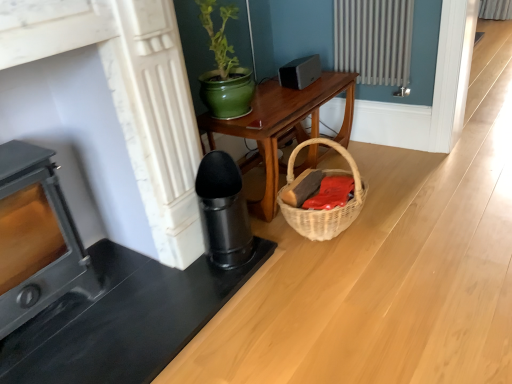
Describe the element at coordinates (331, 193) in the screenshot. This screenshot has height=384, width=512. I see `woven basket at lower right` at that location.

The image size is (512, 384). Describe the element at coordinates (34, 235) in the screenshot. I see `metallic gray heater at left` at that location.

The height and width of the screenshot is (384, 512). Describe the element at coordinates (300, 72) in the screenshot. I see `satin black speaker at upper center` at that location.

Identify the location of woven natural basket at center. Image resolution: width=512 pixels, height=384 pixels. (324, 210).

Identify the location of wooden table at center. (283, 126).

How far apart are wooden table at center and satin black speaker at upper center?

wooden table at center and satin black speaker at upper center are 12.38 inches apart.

Which is correct: wooden table at center is inside satin black speaker at upper center, or outside of it?

wooden table at center is not inside satin black speaker at upper center, it's outside.

Is wooden table at center aimed at satin black speaker at upper center?

No, wooden table at center does not turn towards satin black speaker at upper center.

Between wooden table at center and satin black speaker at upper center, which one has larger size?

wooden table at center is bigger.

Does metallic gray heater at left appear on the left side of woven natural basket at center?

Correct, you'll find metallic gray heater at left to the left of woven natural basket at center.

Choose the correct answer: Is metallic gray heater at left inside woven natural basket at center or outside it?

metallic gray heater at left is outside woven natural basket at center.

Which object is closer to the camera taking this photo, metallic gray heater at left or woven natural basket at center?

metallic gray heater at left is closer to the camera.

Based on the photo, would you say woven natural basket at center is a long distance from satin black speaker at upper center?

That's not correct — woven natural basket at center is a little close to satin black speaker at upper center.

Who is bigger, woven natural basket at center or satin black speaker at upper center?

woven natural basket at center.

Would you say woven natural basket at center is inside or outside satin black speaker at upper center?

woven natural basket at center exists outside the volume of satin black speaker at upper center.

Is point (278, 199) closer or farther from the camera than point (287, 77)?

Point (278, 199).

From the image's perspective, relative to metallic gray heater at left, is woven natural basket at center above or below?

A: woven natural basket at center is situated higher than metallic gray heater at left in the image.

Considering the sizes of woven natural basket at center and metallic gray heater at left in the image, is woven natural basket at center taller or shorter than metallic gray heater at left?

Considering their sizes, woven natural basket at center has less height than metallic gray heater at left.

From a real-world perspective, which is physically below, woven natural basket at center or metallic gray heater at left?

In real-world perspective, woven natural basket at center is lower.

Is woven natural basket at center oriented towards metallic gray heater at left?

No, woven natural basket at center is not turned towards metallic gray heater at left.

Consider the image. Between wooden table at center and woven natural basket at center, which one is positioned in front?

woven natural basket at center is in front.

Looking at this image, is wooden table at center situated inside woven natural basket at center or outside?

wooden table at center lies outside woven natural basket at center.

From the image's perspective, does wooden table at center appear lower than woven natural basket at center?

Incorrect, from the image's perspective, wooden table at center is higher than woven natural basket at center.

Who is shorter, wooden table at center or woven natural basket at center?

A: Standing shorter between the two is woven natural basket at center.

Does woven natural basket at center have a larger size compared to woven basket at lower right?

Indeed, woven natural basket at center has a larger size compared to woven basket at lower right.

Does point (348, 161) lie in front of point (325, 193)?

Yes, point (348, 161) is in front of point (325, 193).

Is woven natural basket at center facing away from woven basket at lower right?

Yes, woven basket at lower right is at the back of woven natural basket at center.

In the image, is woven natural basket at center on the left side or the right side of woven basket at lower right?

Based on their positions, woven natural basket at center is located to the left of woven basket at lower right.

From the image's perspective, would you say woven basket at lower right is shown under wooden table at center?

Yes, from the image's perspective, woven basket at lower right is beneath wooden table at center.

Looking at this image, considering the relative sizes of woven basket at lower right and wooden table at center in the image provided, is woven basket at lower right taller than wooden table at center?

In fact, woven basket at lower right may be shorter than wooden table at center.

Is woven basket at lower right smaller than wooden table at center?

Indeed, woven basket at lower right has a smaller size compared to wooden table at center.

Is wooden table at center at the back of woven basket at lower right?

Yes.

Find the location of `table below the satin black speaker at upper center (from the image's perspective)`. table below the satin black speaker at upper center (from the image's perspective) is located at coordinates (283, 126).

Where is `basket on the right side of metallic gray heater at left`? The image size is (512, 384). basket on the right side of metallic gray heater at left is located at coordinates (324, 210).

Considering their positions, is satin black speaker at upper center positioned closer to wooden table at center than woven basket at lower right?

satin black speaker at upper center is positioned closer to the anchor wooden table at center.

Looking at the image, which one is located closer to woven natural basket at center, wooden table at center or satin black speaker at upper center?

Based on the image, wooden table at center appears to be nearer to woven natural basket at center.

Which object lies nearer to the anchor point woven natural basket at center, woven basket at lower right or metallic gray heater at left?

Among the two, woven basket at lower right is located nearer to woven natural basket at center.

When comparing their distances from woven basket at lower right, does metallic gray heater at left or wooden table at center seem closer?

The object closer to woven basket at lower right is wooden table at center.

Based on their spatial positions, is woven natural basket at center or woven basket at lower right closer to metallic gray heater at left?

woven natural basket at center.

From the image, which object appears to be nearer to metallic gray heater at left, woven basket at lower right or satin black speaker at upper center?

Among the two, woven basket at lower right is located nearer to metallic gray heater at left.

From the picture: Which object lies nearer to the anchor point woven natural basket at center, metallic gray heater at left or woven basket at lower right?

The object closer to woven natural basket at center is woven basket at lower right.

Estimate the real-world distances between objects in this image. Which object is closer to metallic gray heater at left, wooden table at center or satin black speaker at upper center?

The object closer to metallic gray heater at left is wooden table at center.

Locate an element on the screen. The height and width of the screenshot is (384, 512). table between satin black speaker at upper center and woven basket at lower right from top to bottom is located at coordinates (283, 126).

You are a GUI agent. You are given a task and a screenshot of the screen. Output one action in this format:
    pyautogui.click(x=<x>, y=<y>)
    Task: Click on the table located between woven natural basket at center and satin black speaker at upper center in the depth direction
    This screenshot has height=384, width=512.
    Given the screenshot: What is the action you would take?
    pyautogui.click(x=283, y=126)

I want to click on table located between metallic gray heater at left and satin black speaker at upper center in the left-right direction, so click(283, 126).

This screenshot has width=512, height=384. Find the location of `table between metallic gray heater at left and woven basket at lower right in the horizontal direction`. table between metallic gray heater at left and woven basket at lower right in the horizontal direction is located at coordinates (283, 126).